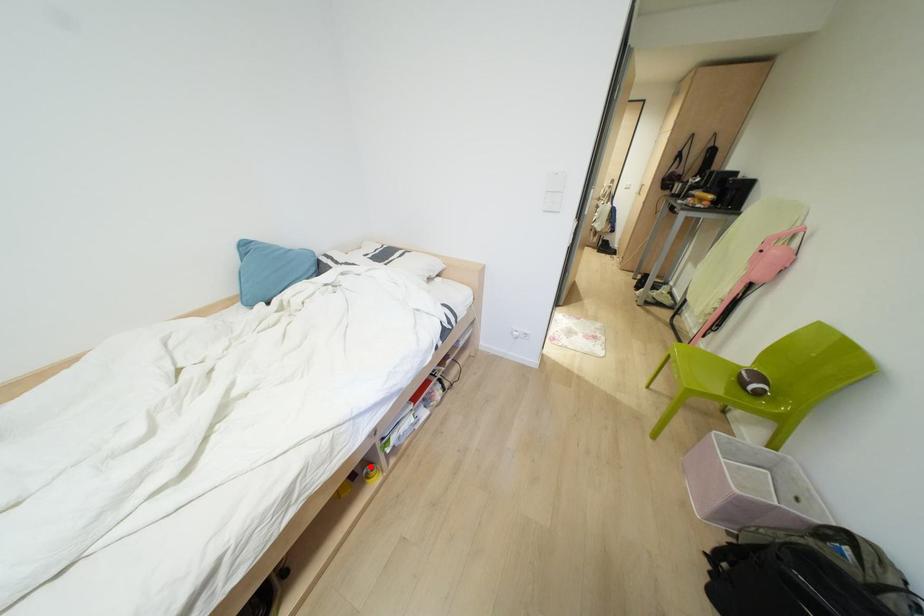
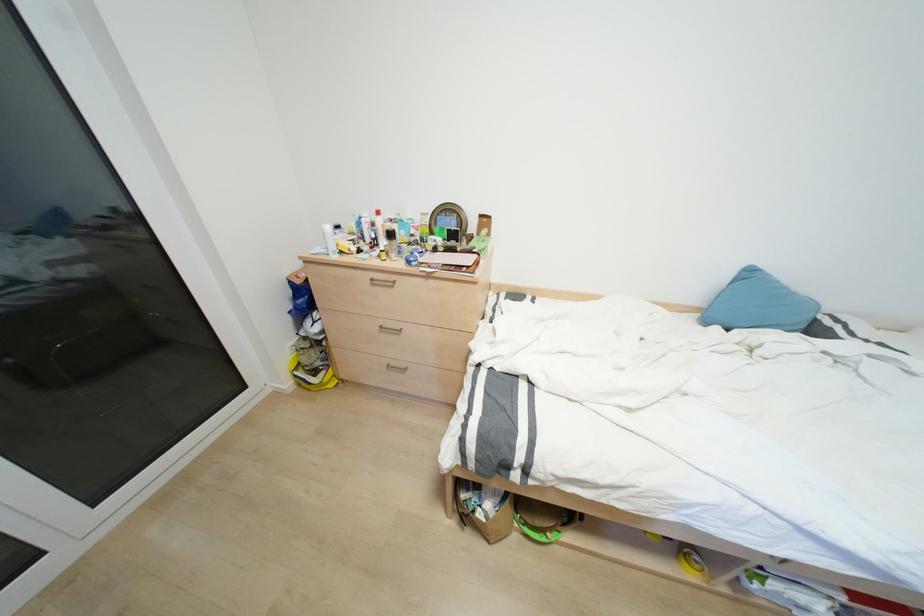
Question: I am providing you with two images of the same scene from different viewpoints. A red point is marked on the first image. Is the red point's position out of view in image 2?

Choices:
 (A) Yes
 (B) No

Answer: (B)